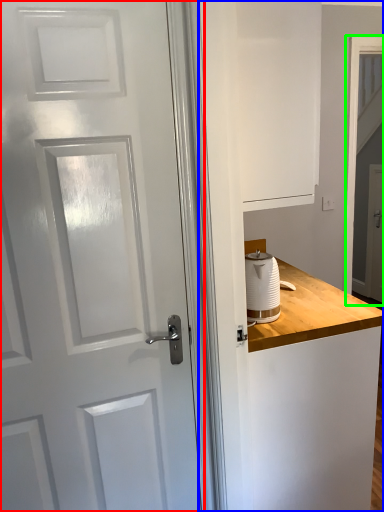
Question: Based on their relative distances, which object is farther from door (highlighted by a red box)? Choose from dresser (highlighted by a blue box) and screen door (highlighted by a green box).

Choices:
 (A) dresser
 (B) screen door

Answer: (B)